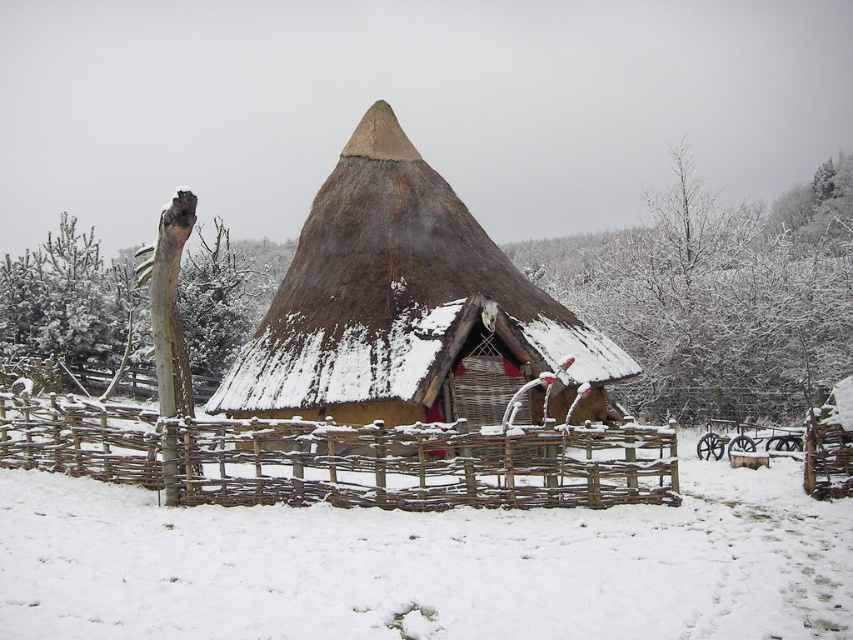
Who is positioned more to the left, thatched straw hut at center or woven wood fence at center?

Positioned to the left is woven wood fence at center.

The image size is (853, 640). What do you see at coordinates (399, 301) in the screenshot?
I see `thatched straw hut at center` at bounding box center [399, 301].

Describe the element at coordinates (399, 301) in the screenshot. Image resolution: width=853 pixels, height=640 pixels. I see `thatched straw hut at center` at that location.

Locate an element on the screen. thatched straw hut at center is located at coordinates (399, 301).

Is point (584, 554) more distant than point (392, 403)?

No, (584, 554) is in front of (392, 403).

Is the position of white fluffy snow at center less distant than that of thatched straw hut at center?

Yes, white fluffy snow at center is in front of thatched straw hut at center.

Between point (149, 554) and point (509, 266), which one is positioned behind?

Point (509, 266)

Locate an element on the screen. The image size is (853, 640). white fluffy snow at center is located at coordinates (402, 550).

Is white fluffy snow at center to the right of woven wood fence at center from the viewer's perspective?

Yes, white fluffy snow at center is to the right of woven wood fence at center.

Between point (546, 566) and point (410, 472), which one is positioned in front?

Point (546, 566) is more forward.

The width and height of the screenshot is (853, 640). Identify the location of white fluffy snow at center. (402, 550).